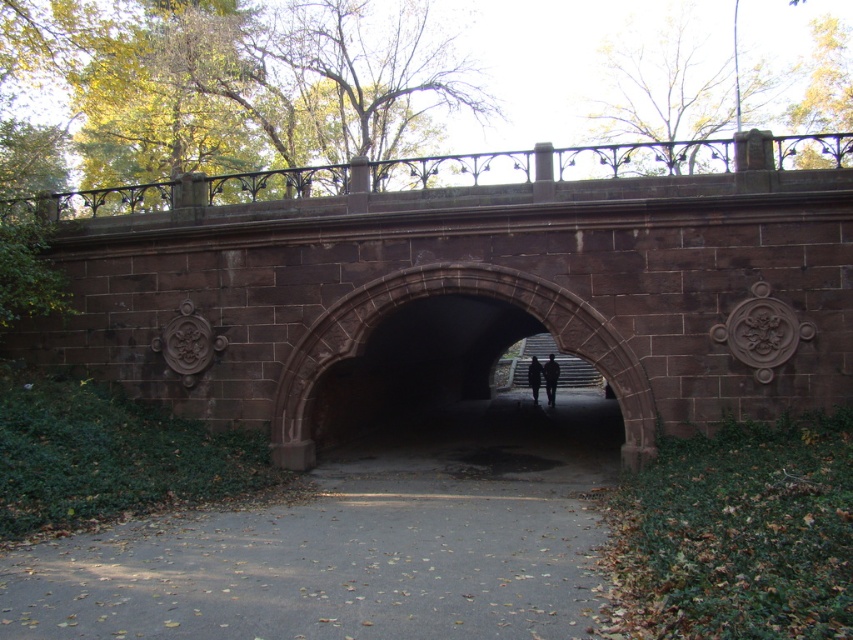
You are a delivery person with a cart that is 6 meters long. You need to move your cart through the path between the gray asphalt path at center and the dark brown stone archway at center. Can your cart fit through the space between them?

The distance between the gray asphalt path at center and the dark brown stone archway at center is 5.70 meters. Since the cart is 6 meters long, it cannot fit through the space between them.

You are standing on the stone bridge and want to take a photo of both the point at coordinates point (358, 307) and point (532, 380). Which point should you focus on first to ensure both are in focus?

You should focus on point (358, 307) first since it is closer to the camera than point (532, 380), ensuring both points are within the depth of field.

You are a pedestrian standing on the brown stone bridge at center and looking towards the dark gray fabric jacket at center. Which object is closer to you?

The brown stone bridge at center is closer to you since it is in front of the dark gray fabric jacket at center.